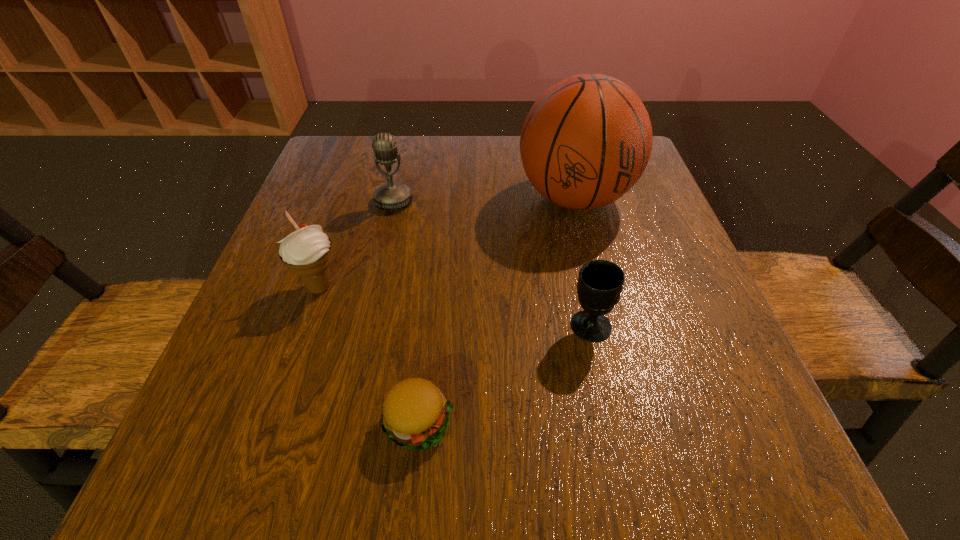
Image resolution: width=960 pixels, height=540 pixels. I want to click on free space that is in between the third object from left to right and the chalice, so click(504, 374).

Locate an element on the screen. vacant region between the fourth tallest object and the basketball is located at coordinates (582, 262).

The height and width of the screenshot is (540, 960). What are the coordinates of `free space between the shortest object and the third nearest object` in the screenshot? It's located at (369, 355).

Locate an element on the screen. The height and width of the screenshot is (540, 960). vacant area that lies between the third nearest object and the tallest object is located at coordinates (447, 242).

The image size is (960, 540). Identify the location of unoccupied position between the chalice and the second object from left to right. (492, 264).

You are a GUI agent. You are given a task and a screenshot of the screen. Output one action in this format:
    pyautogui.click(x=<x>, y=<y>)
    Task: Click on the free spot between the second shortest object and the microphone
    The width and height of the screenshot is (960, 540).
    Given the screenshot: What is the action you would take?
    pyautogui.click(x=492, y=264)

Identify the location of object identified as the fourth closest to the fourth object from right to left. (415, 415).

At what (x,y) coordinates should I click in order to perform the action: click on object that is the closest one to the second shortest object. Please return your answer as a coordinate pair (x, y). Looking at the image, I should click on (586, 141).

The width and height of the screenshot is (960, 540). I want to click on free spot that satisfies the following two spatial constraints: 1. on the front-facing side of the microphone; 2. on the right side of the shortest object, so click(x=344, y=422).

Identify the location of free location that satisfies the following two spatial constraints: 1. on the front side of the hamburger; 2. on the left side of the third nearest object. (274, 422).